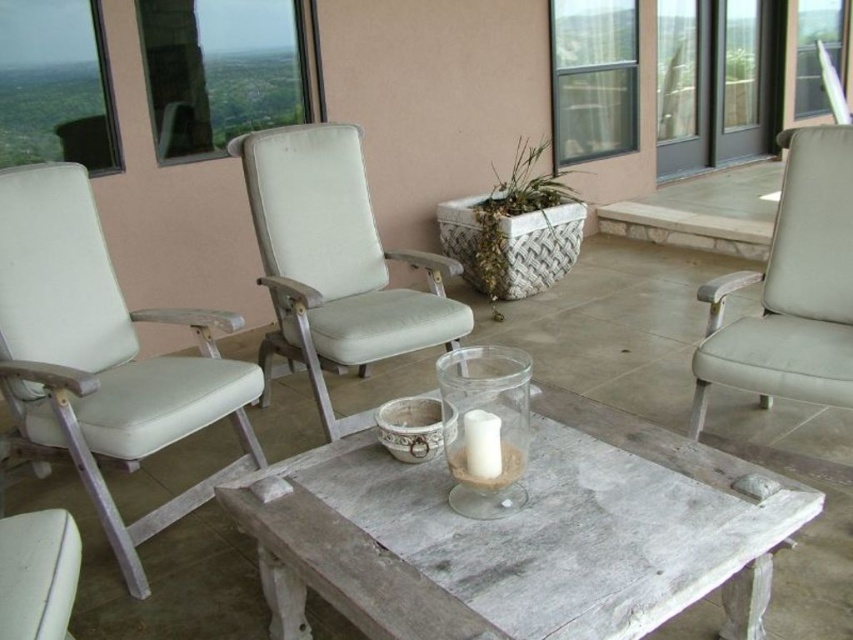
You are sitting on the white fabric armchair at center and want to place your drink on the white distressed wood table at center. Can you easily reach the table from your current position?

The white distressed wood table at center is closer to the viewer than the white fabric armchair at center, so yes, you can easily reach the table from your current position as it is nearer to you.

You are standing at the edge of the patio and want to walk towards the point labeled as point (705, 547). Which direction should you move relative to the other point labeled point (792, 248)?

Point (705, 547) is in front of point (792, 248), so you should move towards the direction of point (705, 547) which is closer to you compared to point (792, 248).

You are standing at the point marked as point (640, 424) and want to reach the entrance of the patio. The entrance is located 1.89 meters away from your current position. If you walk straight towards the entrance, will you pass by any objects on your way?

The entrance is 1.89 meters away from point (640, 424), so walking straight towards it would not pass by any objects since the distance matches exactly the separation between them.